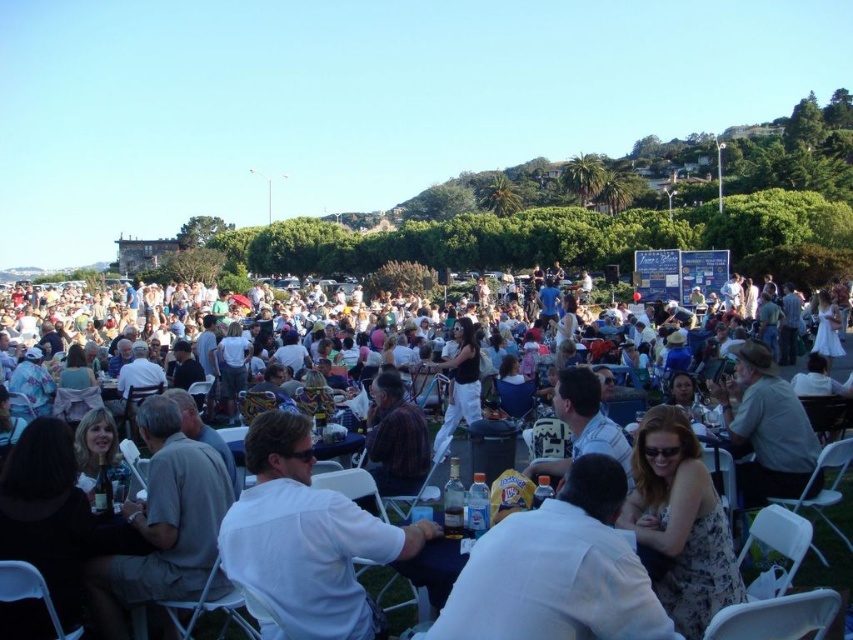
What is the spatial relationship between the white shirt at center and the white plastic chairs at center in the scene?

The white shirt at center is positioned behind the white plastic chairs at center, meaning the chairs are closer to the observer while the shirt is located farther back.

You are a photographer standing at the edge of the event area. You want to take a photo of the white plastic chairs at center and the white shirt at center so that both are clearly visible. However, you notice that one object is much taller than the other. Which object will appear larger in the photo?

The white plastic chairs at center will appear larger in the photo because they are much taller than the white shirt at center.